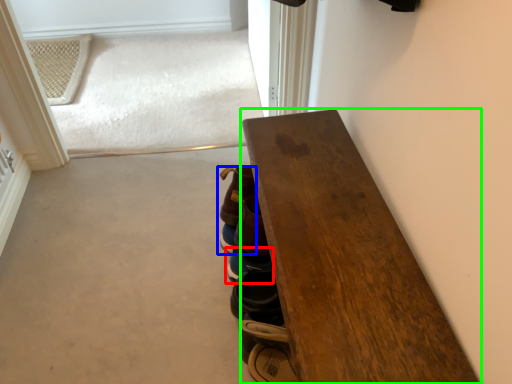
Question: Based on their relative distances, which object is nearer to footwear (highlighted by a red box)? Choose from footwear (highlighted by a blue box) and table (highlighted by a green box).

Choices:
 (A) footwear
 (B) table

Answer: (A)